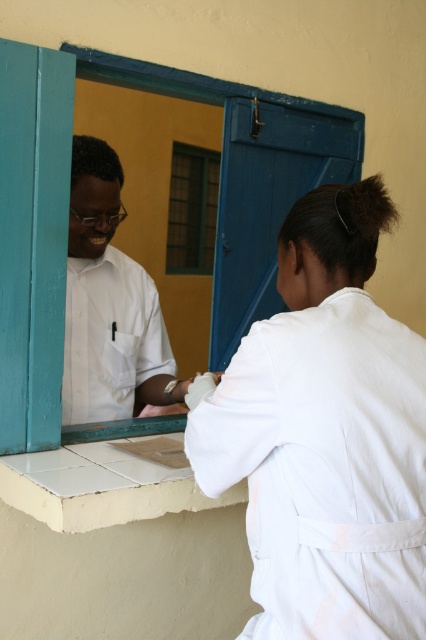
You are standing in the office and want to clean the white cloth at right and the teal wood window frame at upper center. Which object should you clean first if you want to start with the one nearest to you?

The white cloth at right is closer to the viewer than the teal wood window frame at upper center, so you should clean the white cloth at right first.

You are standing in the office and need to reach the point at coordinates (422, 563). The counter is 3 feet wide. Can you step around the counter to reach it?

The point at coordinates (422, 563) is 3.91 feet from the camera, so stepping around the 3 feet wide counter should be possible as the distance allows for maneuvering around the counter.

You are standing in the office scene and want to place a small sticker on the point closer to you. Which point should you choose between point [210,396] and point [325,129]?

You should choose point [210,396] because it is closer to you than point [325,129].